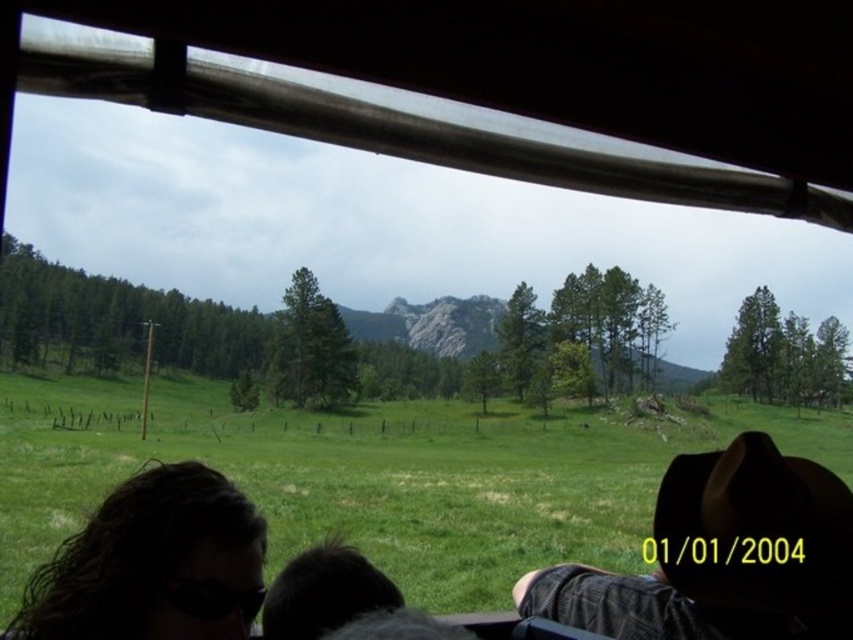
You are a passenger in the vehicle and want to know which object is bigger between the brown felt hat at lower right and the black fur at lower center. Can you tell me?

The brown felt hat at lower right is larger in size than the black fur at lower center.

You are inside a vehicle and looking out through an open window. You see two points marked in the scene. Which point is closer to you, point (126, 560) or point (334, 595)?

Point (126, 560) is closer to the viewer than point (334, 595).

You are inside a vehicle and want to know the distance between the brown felt hat at lower right and the dark hair at lower left. Can you estimate how far apart they are?

The brown felt hat at lower right is 13.63 feet from dark hair at lower left.